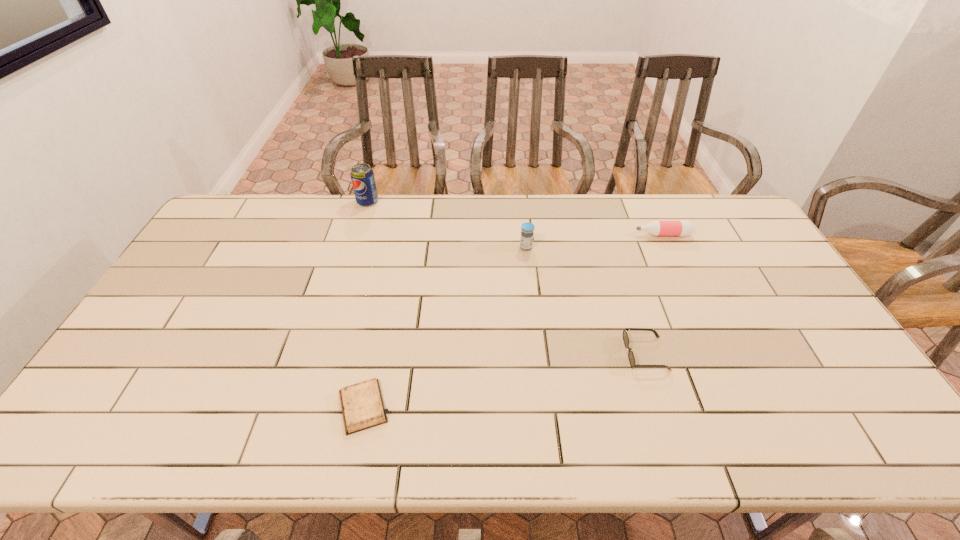
Find the location of a particular element. The width and height of the screenshot is (960, 540). the leftmost object is located at coordinates (362, 176).

Image resolution: width=960 pixels, height=540 pixels. Identify the location of the tallest object. (362, 176).

Find the location of a particular element. This screenshot has height=540, width=960. the fourth shortest object is located at coordinates (526, 240).

I want to click on the third nearest object, so click(526, 240).

This screenshot has height=540, width=960. I want to click on the second farthest object, so click(682, 228).

This screenshot has width=960, height=540. What are the coordinates of `bottle` in the screenshot? It's located at click(682, 228).

Image resolution: width=960 pixels, height=540 pixels. Find the location of `the fourth farthest object`. the fourth farthest object is located at coordinates (631, 358).

What are the coordinates of `sunglasses` in the screenshot? It's located at (631, 358).

The height and width of the screenshot is (540, 960). Identify the location of the nearest object. (362, 405).

This screenshot has width=960, height=540. In order to click on the second object from left to right in this screenshot , I will do point(362,405).